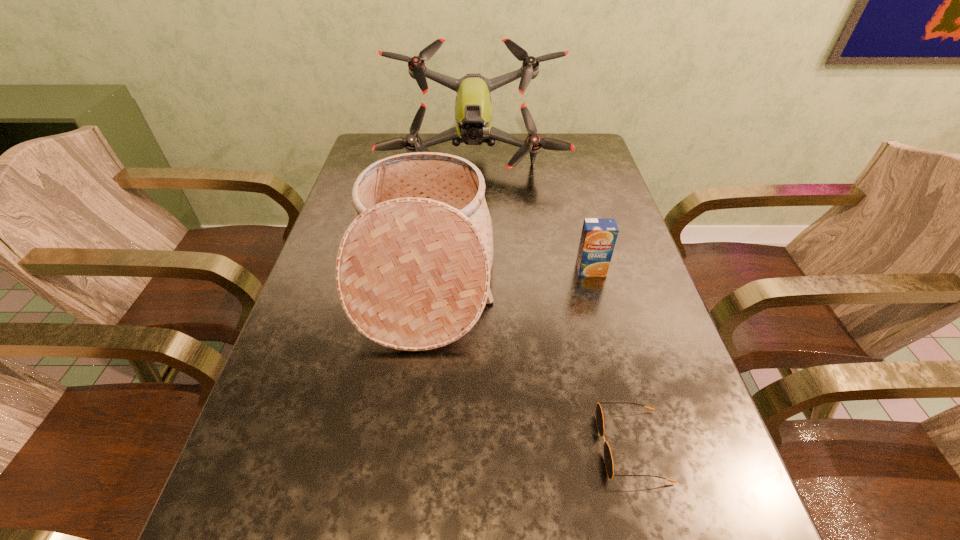
At what (x,y) coordinates should I click in order to perform the action: click on free space located 0.190m on the front-facing side of the nearest object. Please return your answer as a coordinate pair (x, y). This screenshot has height=540, width=960. Looking at the image, I should click on (485, 446).

Identify the location of vacant area situated 0.170m on the front-facing side of the nearest object. (497, 446).

Find the location of a particular element. The image size is (960, 540). object present at the far edge is located at coordinates (473, 112).

Where is `drone that is at the left edge`? Image resolution: width=960 pixels, height=540 pixels. drone that is at the left edge is located at coordinates (473, 112).

This screenshot has width=960, height=540. What are the coordinates of `basket at the left edge` in the screenshot? It's located at (412, 273).

Find the location of a particular element. drone that is at the right edge is located at coordinates (473, 112).

You are a GUI agent. You are given a task and a screenshot of the screen. Output one action in this format:
    pyautogui.click(x=<x>, y=<y>)
    Task: Click on the orange_juice at the right edge
    Image resolution: width=960 pixels, height=540 pixels.
    Given the screenshot: What is the action you would take?
    pyautogui.click(x=599, y=235)

Image resolution: width=960 pixels, height=540 pixels. Identify the location of sunglasses that is at the right edge. (608, 459).

Where is `object located in the far left corner section of the desktop`? The image size is (960, 540). object located in the far left corner section of the desktop is located at coordinates (473, 112).

Where is `object that is at the far right corner`? The image size is (960, 540). object that is at the far right corner is located at coordinates (473, 112).